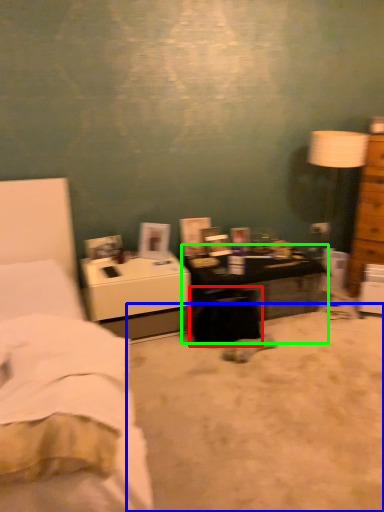
Question: Which object is the closest to the swivel chair (highlighted by a red box)? Choose among these: plain (highlighted by a blue box) or desk (highlighted by a green box).

Choices:
 (A) plain
 (B) desk

Answer: (B)